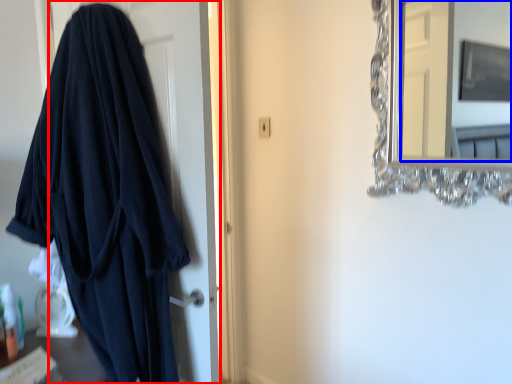
Question: Which object is further to the camera taking this photo, door (highlighted by a red box) or mirror (highlighted by a blue box)?

Choices:
 (A) door
 (B) mirror

Answer: (A)